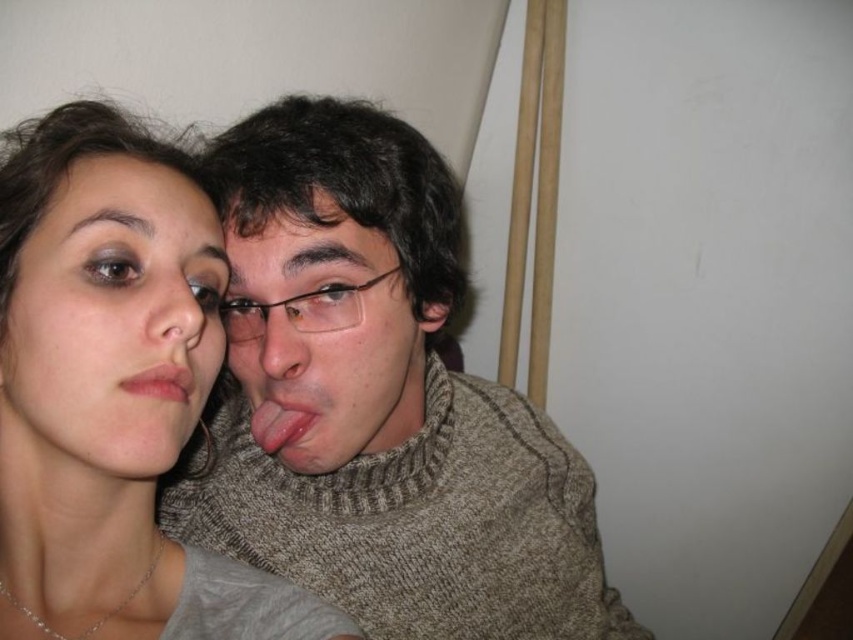
You are a photographer adjusting your camera settings to focus on the knitted sweater at center. The camera has a minimum focusing distance of 18 inches. Will you need to move closer or farther away to ensure the sweater is in focus?

The knitted sweater at center is 18.71 inches away from camera, which is slightly beyond the camera minimum focusing distance of 18 inches. You will need to move closer to the sweater to ensure it is in focus.

You are a photographer trying to capture a clear shot of the pink matte lips at center and the knitted sweater at center. Which object should you focus on first to ensure it appears sharp in the photo?

You should focus on the knitted sweater at center first because the pink matte lips at center is behind it, so ensuring the sweater is in focus will naturally keep the lips sharp as well.